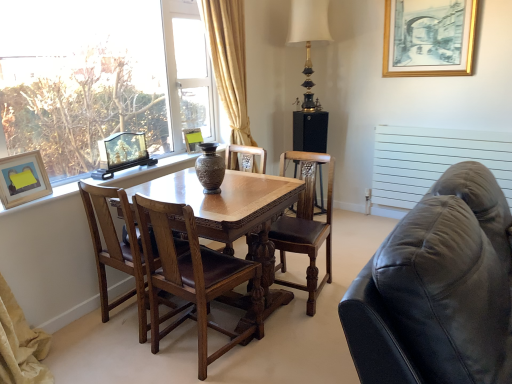
This screenshot has height=384, width=512. I want to click on vacant area on top of white matte radiator at right (from a real-world perspective), so click(x=442, y=121).